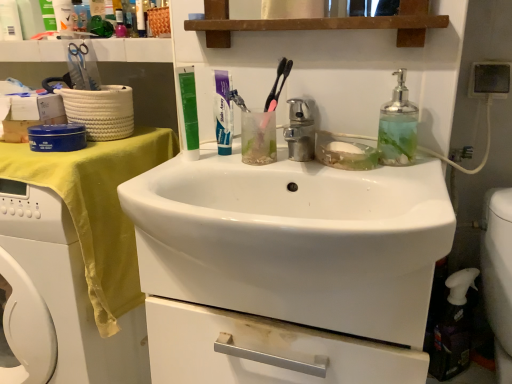
The height and width of the screenshot is (384, 512). Identify the location of green matte toothpaste tube at upper center. (189, 111).

Describe the element at coordinates (398, 126) in the screenshot. I see `clear glass soap dispenser at right` at that location.

I want to click on yellow fabric at left, so click(x=95, y=217).

Between point (392, 121) and point (181, 82), which one is positioned behind?

The point (181, 82) is farther from the camera.

Which of these two, clear glass soap dispenser at right or green matte toothpaste tube at upper center, stands taller?

green matte toothpaste tube at upper center is taller.

Does clear glass soap dispenser at right have a smaller size compared to green matte toothpaste tube at upper center?

Actually, clear glass soap dispenser at right might be larger than green matte toothpaste tube at upper center.

Does clear glass soap dispenser at right turn towards green matte toothpaste tube at upper center?

No, clear glass soap dispenser at right is not facing towards green matte toothpaste tube at upper center.

Could you tell me if white glossy sink at center is turned towards green matte toothpaste tube at upper center?

No, white glossy sink at center is not facing towards green matte toothpaste tube at upper center.

Is white glossy sink at center outside of green matte toothpaste tube at upper center?

That's correct, white glossy sink at center is outside of green matte toothpaste tube at upper center.

From a real-world perspective, relative to green matte toothpaste tube at upper center, is white glossy sink at center vertically above or below?

Clearly, from a real-world perspective, white glossy sink at center is below green matte toothpaste tube at upper center.

Can you tell me how much white glossy sink at center and green matte toothpaste tube at upper center differ in facing direction?

The facing directions of white glossy sink at center and green matte toothpaste tube at upper center are 0.00576 degrees apart.

Does yellow fabric at left appear on the left side of polished chrome faucet at center?

Yes, yellow fabric at left is to the left of polished chrome faucet at center.

Is yellow fabric at left facing away from polished chrome faucet at center?

yellow fabric at left does not have its back to polished chrome faucet at center.

Which of these two, yellow fabric at left or polished chrome faucet at center, is bigger?

yellow fabric at left is bigger.

From a real-world perspective, which object stands above the other?

polished chrome faucet at center, from a real-world perspective.

Is polished chrome faucet at center positioned in front of white plastic spray bottle at lower right?

Yes, it is in front of white plastic spray bottle at lower right.

How different are the orientations of polished chrome faucet at center and white plastic spray bottle at lower right in degrees?

There is a 2.64-degree angle between the facing directions of polished chrome faucet at center and white plastic spray bottle at lower right.

Is polished chrome faucet at center facing away from white plastic spray bottle at lower right?

That's not correct — polished chrome faucet at center is not looking away from white plastic spray bottle at lower right.

Looking at their sizes, would you say green matte toothpaste tube at upper center is wider or thinner than yellow fabric at left?

Considering their sizes, green matte toothpaste tube at upper center looks slimmer than yellow fabric at left.

Can you confirm if green matte toothpaste tube at upper center is bigger than yellow fabric at left?

No, green matte toothpaste tube at upper center is not bigger than yellow fabric at left.

From a real-world perspective, between green matte toothpaste tube at upper center and yellow fabric at left, who is vertically higher?

green matte toothpaste tube at upper center.

Considering the relative positions of white glossy sink at center and white plastic spray bottle at lower right in the image provided, is white glossy sink at center to the left of white plastic spray bottle at lower right from the viewer's perspective?

Yes, white glossy sink at center is to the left of white plastic spray bottle at lower right.

Is white glossy sink at center not within white plastic spray bottle at lower right?

Yes, white glossy sink at center is outside of white plastic spray bottle at lower right.

Which is nearer, [414,340] or [447,296]?

Point [414,340]

Is the depth of white glossy sink at center greater than that of white plastic spray bottle at lower right?

No, white glossy sink at center is closer to the viewer.

Between clear glass soap dispenser at right and polished chrome faucet at center, which one appears on the left side from the viewer's perspective?

polished chrome faucet at center is more to the left.

Image resolution: width=512 pixels, height=384 pixels. Find the location of `tap below the clear glass soap dispenser at right (from a real-world perspective)`. tap below the clear glass soap dispenser at right (from a real-world perspective) is located at coordinates (300, 131).

Can you confirm if clear glass soap dispenser at right is wider than polished chrome faucet at center?

Result: Incorrect, the width of clear glass soap dispenser at right does not surpass that of polished chrome faucet at center.

From the image's perspective, which one is positioned higher, clear glass soap dispenser at right or polished chrome faucet at center?

clear glass soap dispenser at right.

Find the location of `toiletry that is above the clear glass soap dispenser at right (from the image's perspective)`. toiletry that is above the clear glass soap dispenser at right (from the image's perspective) is located at coordinates (189, 111).

Where is `sink lying on the right of green matte toothpaste tube at upper center`? sink lying on the right of green matte toothpaste tube at upper center is located at coordinates (295, 240).

Estimate the real-world distances between objects in this image. Which object is further from white glossy sink at center, clear glass soap dispenser at right or green matte toothpaste tube at upper center?

Based on the image, clear glass soap dispenser at right appears to be further to white glossy sink at center.

Looking at the image, which one is located further to polished chrome faucet at center, white glossy toothpaste at center or white plastic spray bottle at lower right?

white plastic spray bottle at lower right.

From the image, which object appears to be farther from green matte toothpaste tube at upper center, polished chrome faucet at center or clear glass soap dispenser at right?

clear glass soap dispenser at right is further to green matte toothpaste tube at upper center.

Looking at the image, which one is located closer to polished chrome faucet at center, white plastic spray bottle at lower right or clear glass soap dispenser at right?

The object closer to polished chrome faucet at center is clear glass soap dispenser at right.

From the image, which object appears to be farther from green matte toothpaste tube at upper center, polished chrome faucet at center or yellow fabric at left?

Among the two, yellow fabric at left is located further to green matte toothpaste tube at upper center.

When comparing their distances from yellow fabric at left, does white glossy sink at center or white plastic spray bottle at lower right seem further?

white plastic spray bottle at lower right is positioned further to the anchor yellow fabric at left.

Based on their spatial positions, is green matte toothpaste tube at upper center or white glossy toothpaste at center closer to white glossy sink at center?

The object closer to white glossy sink at center is green matte toothpaste tube at upper center.

From the picture: From the image, which object appears to be nearer to green matte toothpaste tube at upper center, clear glass soap dispenser at right or yellow fabric at left?

The object closer to green matte toothpaste tube at upper center is yellow fabric at left.

At what (x,y) coordinates should I click in order to perform the action: click on tap between white glossy sink at center and white glossy toothpaste at center from front to back. Please return your answer as a coordinate pair (x, y). Image resolution: width=512 pixels, height=384 pixels. Looking at the image, I should click on (300, 131).

Locate an element on the screen. The image size is (512, 384). tap between yellow fabric at left and clear glass soap dispenser at right in the horizontal direction is located at coordinates (300, 131).

This screenshot has width=512, height=384. Find the location of `bottle located between white glossy toothpaste at center and white plastic spray bottle at lower right in the left-right direction`. bottle located between white glossy toothpaste at center and white plastic spray bottle at lower right in the left-right direction is located at coordinates (398, 126).

Find the location of a particular element. tap between white glossy toothpaste at center and white plastic spray bottle at lower right is located at coordinates (300, 131).